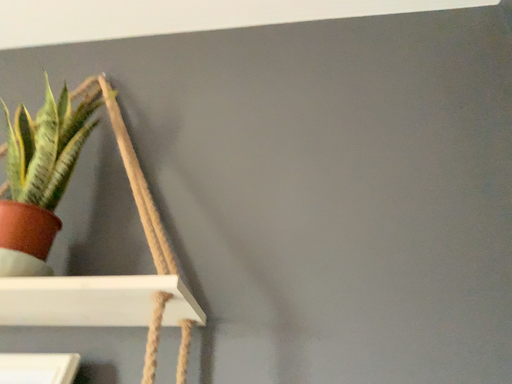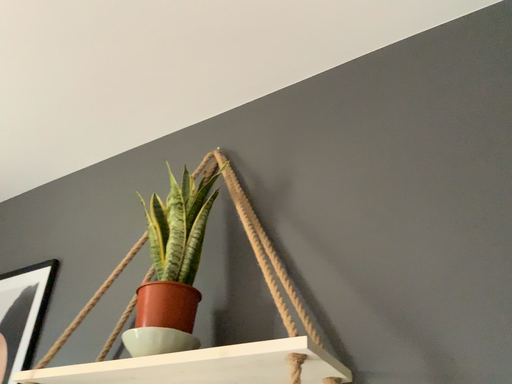
Question: Which way did the camera rotate in the video?

Choices:
 (A) rotated right
 (B) rotated left

Answer: (B)